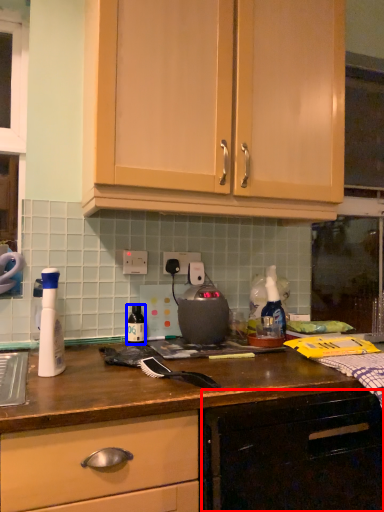
Question: Which object appears closest to the camera in this image, cabinetry (highlighted by a red box) or bottle (highlighted by a blue box)?

Choices:
 (A) cabinetry
 (B) bottle

Answer: (A)